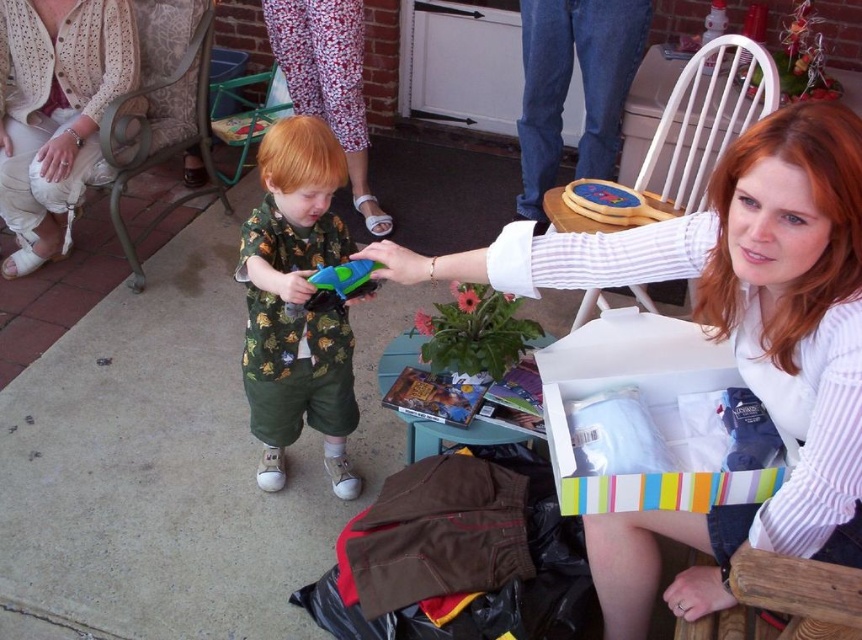
Question: Is white striped shirt at upper right to the right of wooden chair at lower right from the viewer's perspective?

Choices:
 (A) no
 (B) yes

Answer: (A)

Question: Among these points, which one is farthest from the camera?

Choices:
 (A) [x=70, y=52]
 (B) [x=654, y=198]
 (C) [x=814, y=304]

Answer: (A)

Question: From the image, what is the correct spatial relationship of white cardboard box at lower right in relation to metallic green chair at upper center?

Choices:
 (A) below
 (B) above

Answer: (A)

Question: Does printed fabric shirt at center lie behind metallic fabric chair at upper left?

Choices:
 (A) no
 (B) yes

Answer: (A)

Question: Estimate the real-world distances between objects in this image. Which object is farther from the white crochet cardigan at upper left?

Choices:
 (A) wooden chair at lower right
 (B) blue plastic toy at center
 (C) white striped shirt at upper right

Answer: (A)

Question: Which of the following is the closest to the observer?

Choices:
 (A) (273, 88)
 (B) (279, 432)

Answer: (B)